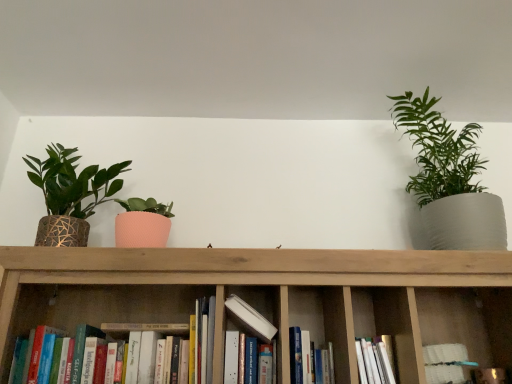
Question: Is wooden bookshelf at center positioned far away from white matte book at center, positioned as the third book in right-to-left order?

Choices:
 (A) no
 (B) yes

Answer: (A)

Question: Can you confirm if wooden bookshelf at center is bigger than white matte book at center, positioned as the third book in right-to-left order?

Choices:
 (A) yes
 (B) no

Answer: (A)

Question: Can you see wooden bookshelf at center touching white matte book at center, positioned as the third book in right-to-left order?

Choices:
 (A) no
 (B) yes

Answer: (A)

Question: From the image's perspective, is wooden bookshelf at center under white matte book at center, positioned as the third book in right-to-left order?

Choices:
 (A) yes
 (B) no

Answer: (A)

Question: Is wooden bookshelf at center at the right side of white matte book at center, which is the 2th book in left-to-right order?

Choices:
 (A) yes
 (B) no

Answer: (A)

Question: Is white matte book at center, which is the 2th book in left-to-right order, inside or outside of hardcover books at center, the fourth book from the right?

Choices:
 (A) inside
 (B) outside

Answer: (B)

Question: From a real-world perspective, is white matte book at center, which is the 2th book in left-to-right order, physically located above or below hardcover books at center, which is counted as the 1th book, starting from the left?

Choices:
 (A) above
 (B) below

Answer: (B)

Question: Considering the relative positions of white matte book at center, positioned as the third book in right-to-left order, and hardcover books at center, which is counted as the 1th book, starting from the left, in the image provided, is white matte book at center, positioned as the third book in right-to-left order, to the left or to the right of hardcover books at center, which is counted as the 1th book, starting from the left,?

Choices:
 (A) right
 (B) left

Answer: (A)

Question: Is white matte book at center, which is the 2th book in left-to-right order, in front of or behind hardcover books at center, the fourth book from the right, in the image?

Choices:
 (A) front
 (B) behind

Answer: (B)

Question: Is white matte book at center, the 4th book in the left-to-right sequence, inside or outside of textured woven pot at left, acting as the first houseplant starting from the left?

Choices:
 (A) outside
 (B) inside

Answer: (A)

Question: From the image's perspective, is white matte book at center, the 4th book in the left-to-right sequence, located above or below textured woven pot at left, acting as the 2th houseplant starting from the right?

Choices:
 (A) below
 (B) above

Answer: (A)

Question: Considering the positions of point (462, 380) and point (48, 236), is point (462, 380) closer or farther from the camera than point (48, 236)?

Choices:
 (A) closer
 (B) farther

Answer: (A)

Question: Relative to textured woven pot at left, acting as the 2th houseplant starting from the right, is white matte book at center, the 4th book in the left-to-right sequence, in front or behind?

Choices:
 (A) front
 (B) behind

Answer: (A)

Question: Is wooden bookshelf at center bigger or smaller than white matte book at center, the 4th book in the left-to-right sequence?

Choices:
 (A) big
 (B) small

Answer: (A)

Question: From a real-world perspective, is wooden bookshelf at center positioned above or below white matte book at center, the 4th book in the left-to-right sequence?

Choices:
 (A) below
 (B) above

Answer: (B)